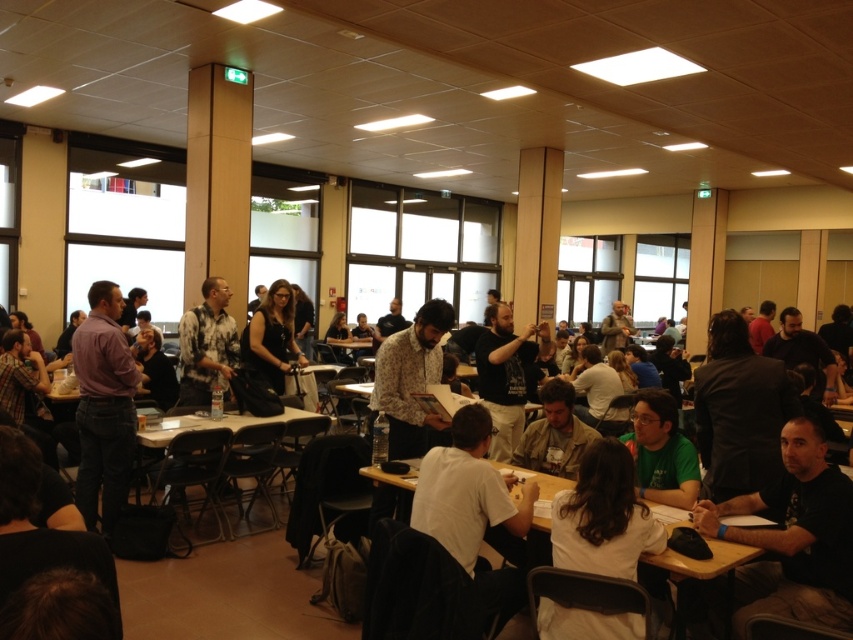
Question: Among these objects, which one is nearest to the camera?

Choices:
 (A) light brown wooden table at center
 (B) wooden table at center

Answer: (B)

Question: Does wooden table at center come behind light brown wooden table at center?

Choices:
 (A) no
 (B) yes

Answer: (A)

Question: Is wooden table at center smaller than light brown wooden table at center?

Choices:
 (A) yes
 (B) no

Answer: (A)

Question: Among these objects, which one is farthest from the camera?

Choices:
 (A) light brown wooden table at center
 (B) wooden table at center

Answer: (A)

Question: Is wooden table at center positioned before light brown wooden table at center?

Choices:
 (A) no
 (B) yes

Answer: (B)

Question: Among these objects, which one is farthest from the camera?

Choices:
 (A) wooden table at center
 (B) light brown wooden table at center

Answer: (B)